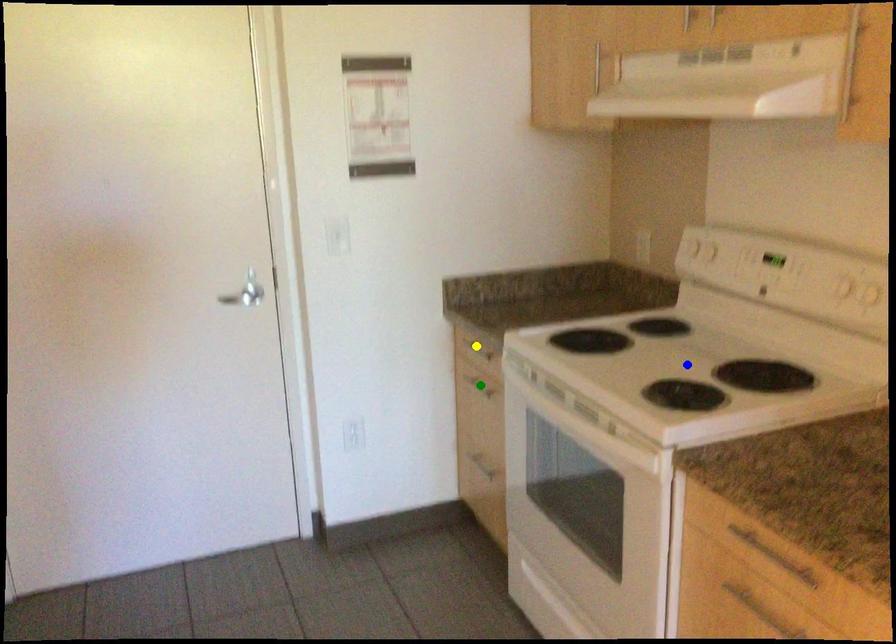
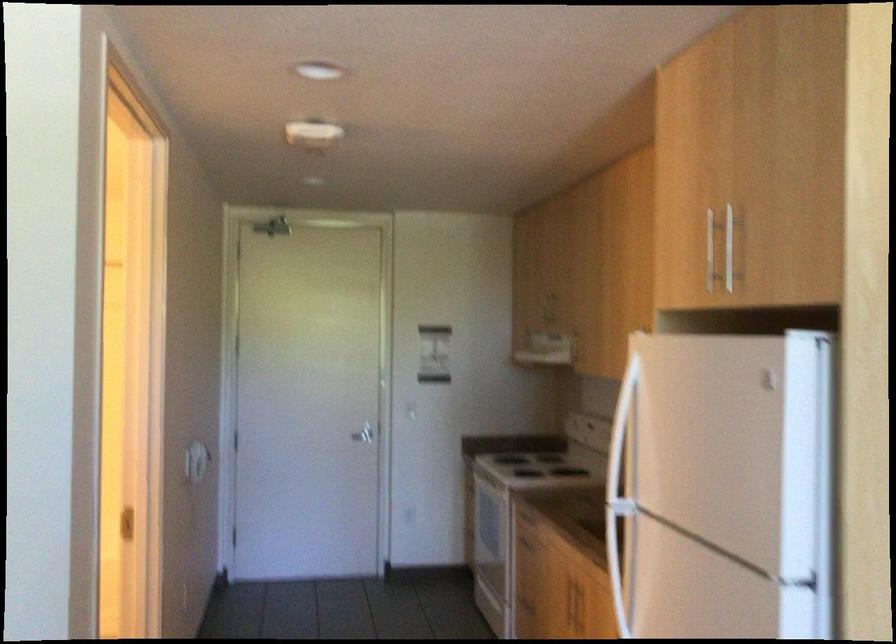
I am providing you with two images of the same scene from different viewpoints. Three points are marked in image1. Which point corresponds to a part or object that is occluded in image2?In image1, three points are marked. Which of them correspond to a part or object that is occluded in image2?Among the three points shown in image1, which one corresponds to a part or object that is no longer visible due to occlusion in image2?

green point, blue point, yellow point